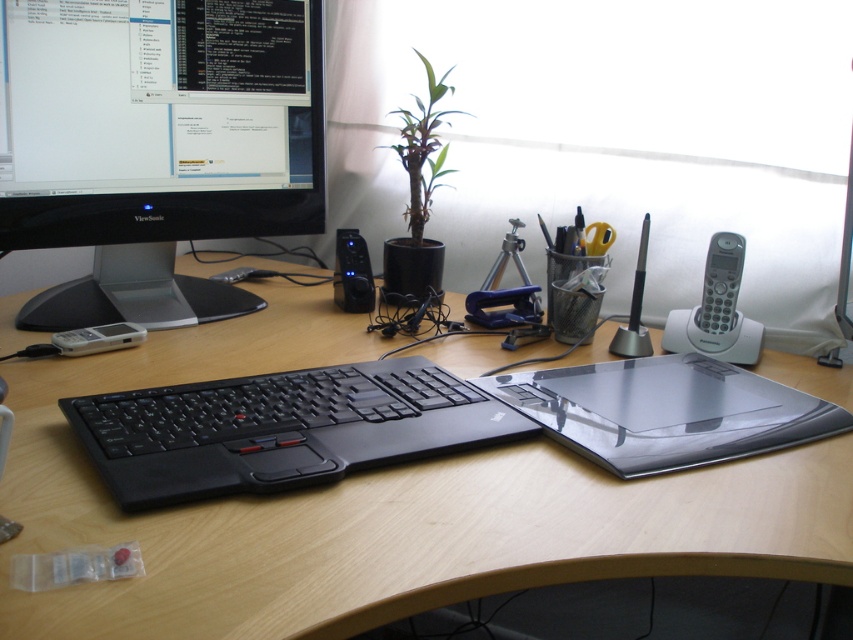
Question: Does black plastic monitor at upper left have a larger size compared to black plastic speaker at center?

Choices:
 (A) no
 (B) yes

Answer: (B)

Question: Which object appears farthest from the camera in this image?

Choices:
 (A) transparent plastic laptop at center
 (B) light brown wood computer desk at center

Answer: (A)

Question: Is light brown wood computer desk at center smaller than black plastic monitor at upper left?

Choices:
 (A) yes
 (B) no

Answer: (B)

Question: Among these points, which one is farthest from the camera?

Choices:
 (A) (273, 464)
 (B) (190, 520)
 (C) (635, 428)

Answer: (C)

Question: Estimate the real-world distances between objects in this image. Which object is farther from the light brown wood computer desk at center?

Choices:
 (A) black matte keyboard at center
 (B) black plastic speaker at center

Answer: (B)

Question: Considering the relative positions of black plastic monitor at upper left and silver plastic remote at left in the image provided, where is black plastic monitor at upper left located with respect to silver plastic remote at left?

Choices:
 (A) above
 (B) below

Answer: (A)